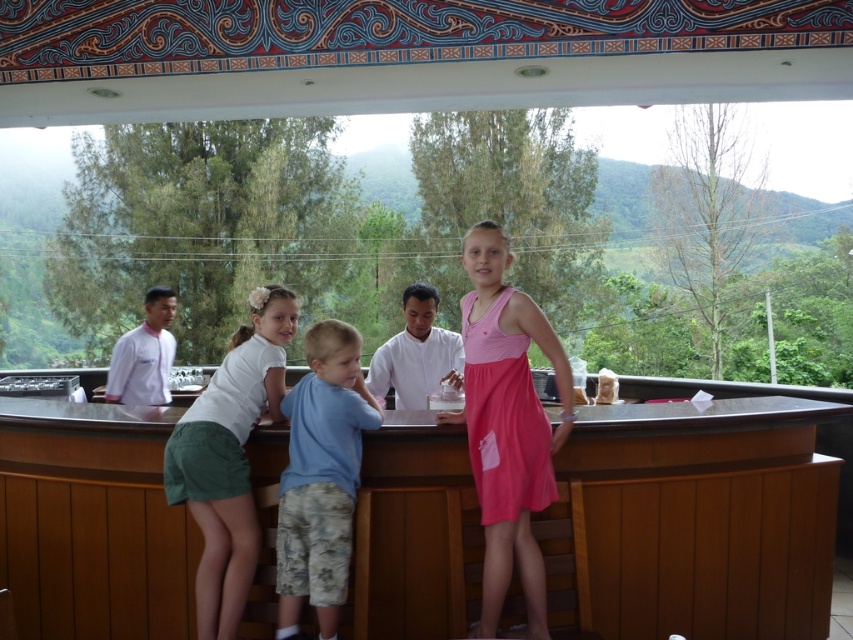
You are a customer at the resort bar. You see the white uniform at left and the clear plastic cup at center. Which object is closer to you?

The white uniform at left is closer to you because the clear plastic cup at center is behind it.

You are a server at the resort bar. You need to place a clear plastic cup at center on the counter without it touching the white smooth shirt at center. Is this possible given their sizes?

The white smooth shirt at center is wider than the clear plastic cup at center. Since the shirt is wider, there is enough space between them to place the cup without touching it.

You are a customer at the bar and want to place your drink on the counter. You have a clear plastic cup at center. Is there enough space between the white smooth shirt at center and the edge of the counter to place your cup?

The white smooth shirt at center has a larger size compared to the clear plastic cup at center. However, the description does not provide information about the distance between the shirt and the edge of the counter. Therefore, it is unclear if there is enough space to place the cup.